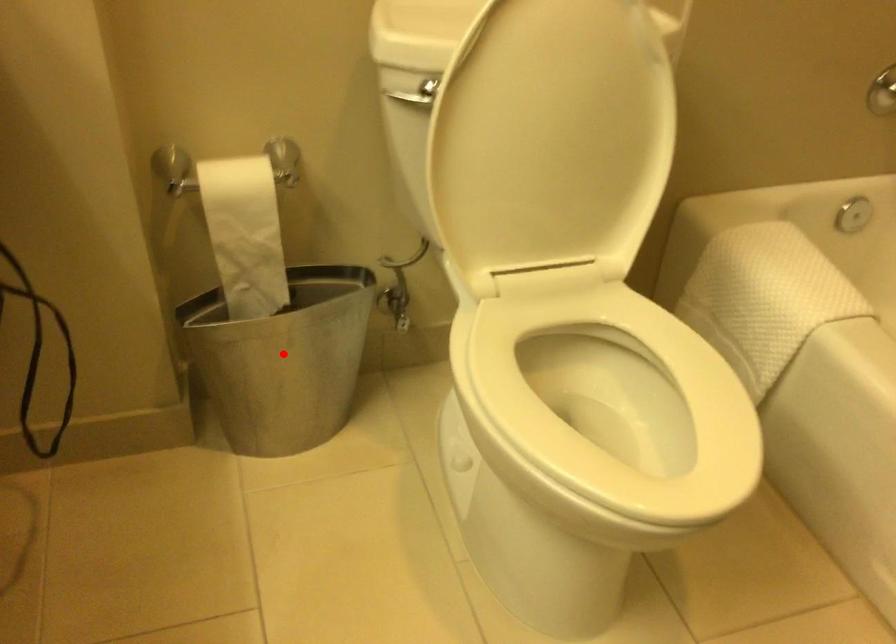
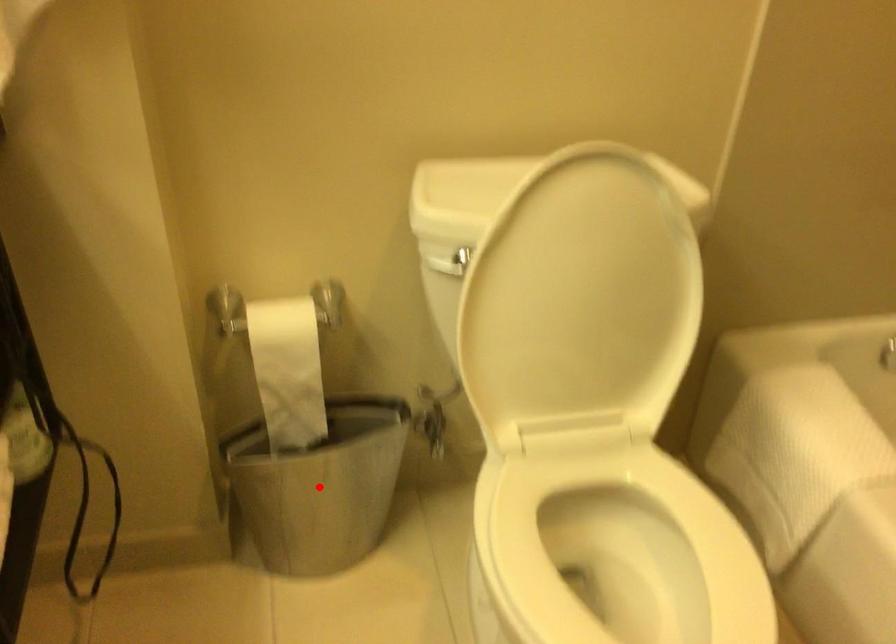
I am providing you with two images of the same scene from different viewpoints. A red point is marked on the first image and another point is marked on the second image. Do the highlighted points in image1 and image2 indicate the same real-world spot?

Yes